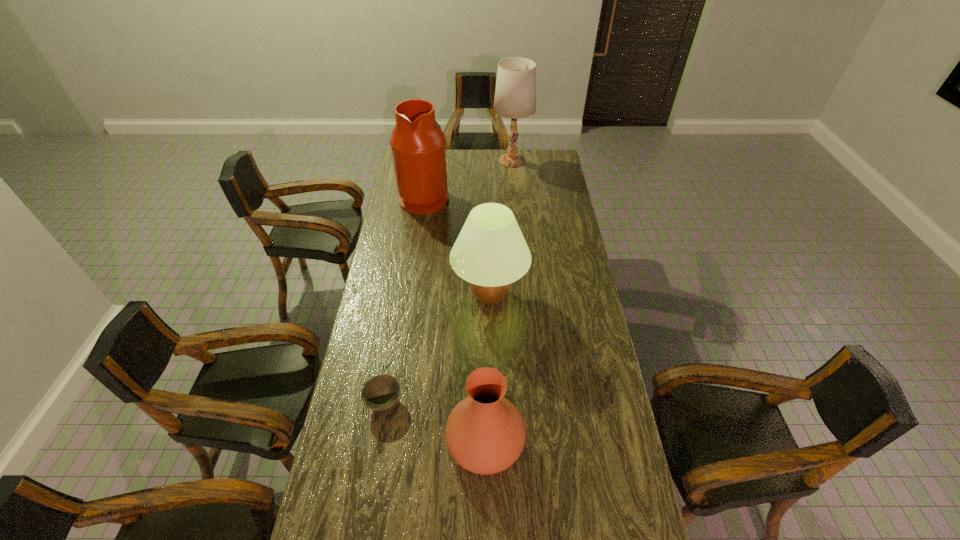
Find the location of a particular element. This screenshot has height=540, width=960. vacant point located between the bowl and the third tallest object is located at coordinates (437, 348).

Locate an element on the screen. vacant area between the second shortest object and the shortest object is located at coordinates (435, 422).

Where is `vacant region between the water jug and the vase`? The image size is (960, 540). vacant region between the water jug and the vase is located at coordinates (455, 320).

The image size is (960, 540). I want to click on object that is the third closest to the bowl, so click(417, 142).

Identify which object is located as the fourth nearest to the water jug. Please provide its 2D coordinates. Your answer should be formatted as a tuple, i.e. [(x, y)], where the tuple contains the x and y coordinates of a point satisfying the conditions above.

[(485, 433)]

The image size is (960, 540). Identify the location of free space that satisfies the following two spatial constraints: 1. on the back side of the vase; 2. on the left side of the farthest object. (483, 161).